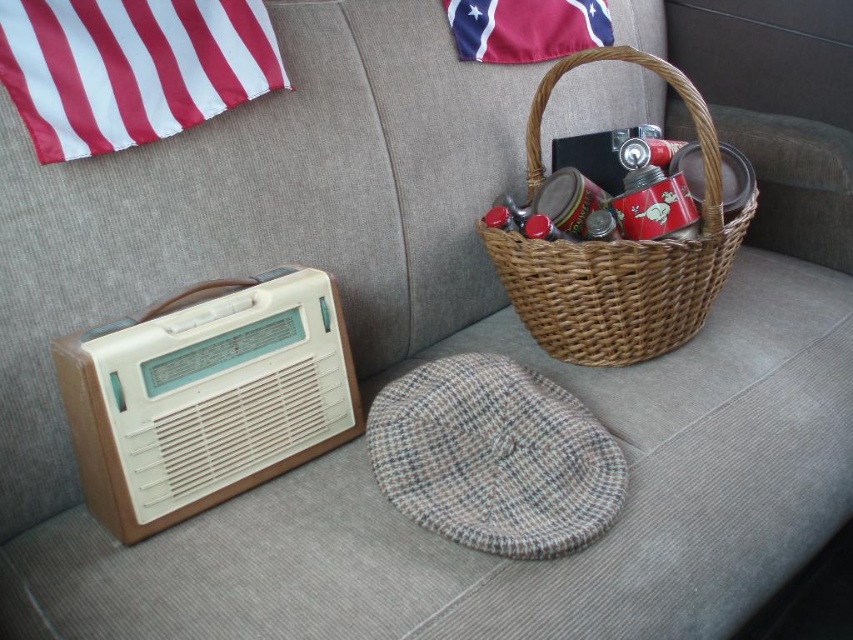
You are trying to place a new book on the couch. The book is 10 cm thick. Can you fit it between the woven brown basket at center and the red cotton flag at upper center?

The woven brown basket at center is much taller than the red cotton flag at upper center, so there is enough vertical space between them to place the book.